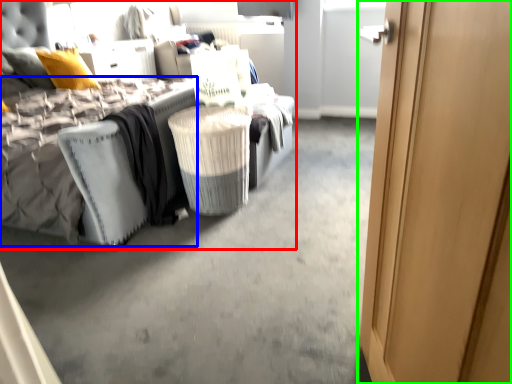
Question: Which object is the closest to the bed (highlighted by a red box)? Choose among these: mattress (highlighted by a blue box) or door (highlighted by a green box).

Choices:
 (A) mattress
 (B) door

Answer: (A)